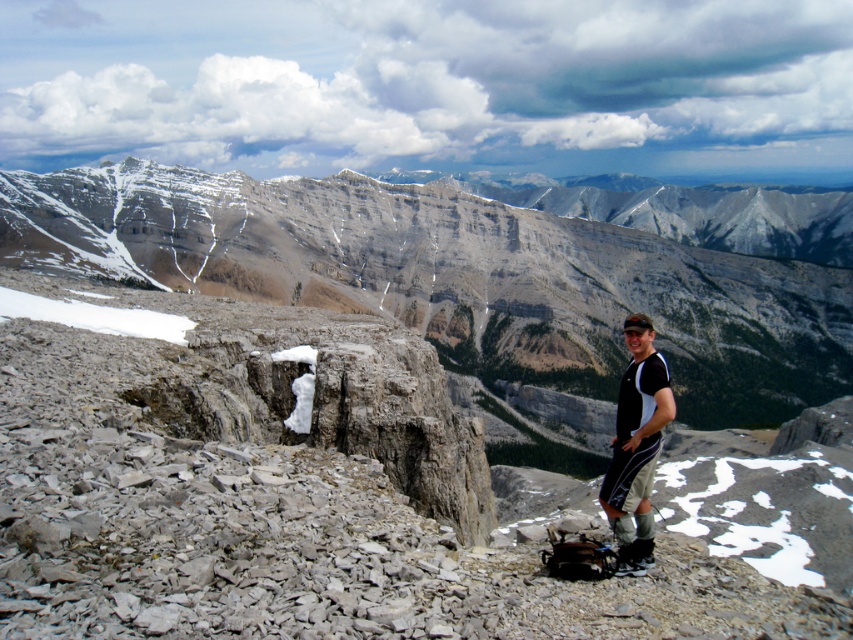
Between gray rocky cliff at center and black fabric shirt at right, which one appears on the left side from the viewer's perspective?

From the viewer's perspective, black fabric shirt at right appears more on the left side.

Which is below, gray rocky cliff at center or black fabric shirt at right?

black fabric shirt at right

Is point (351, 180) closer to camera compared to point (640, 442)?

No, (351, 180) is further to viewer.

Identify the location of gray rocky cliff at center. This screenshot has width=853, height=640. (466, 280).